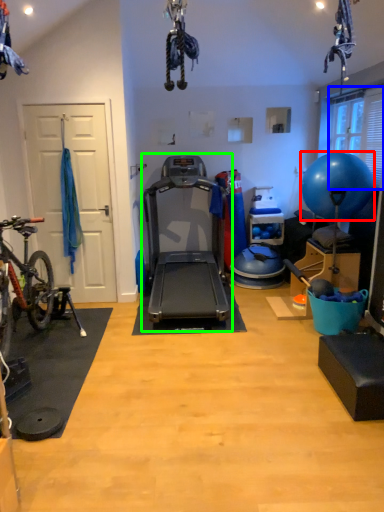
Question: Estimate the real-world distances between objects in this image. Which object is closer to ball (highlighted by a red box), window screen (highlighted by a blue box) or treadmill (highlighted by a green box)?

Choices:
 (A) window screen
 (B) treadmill

Answer: (A)